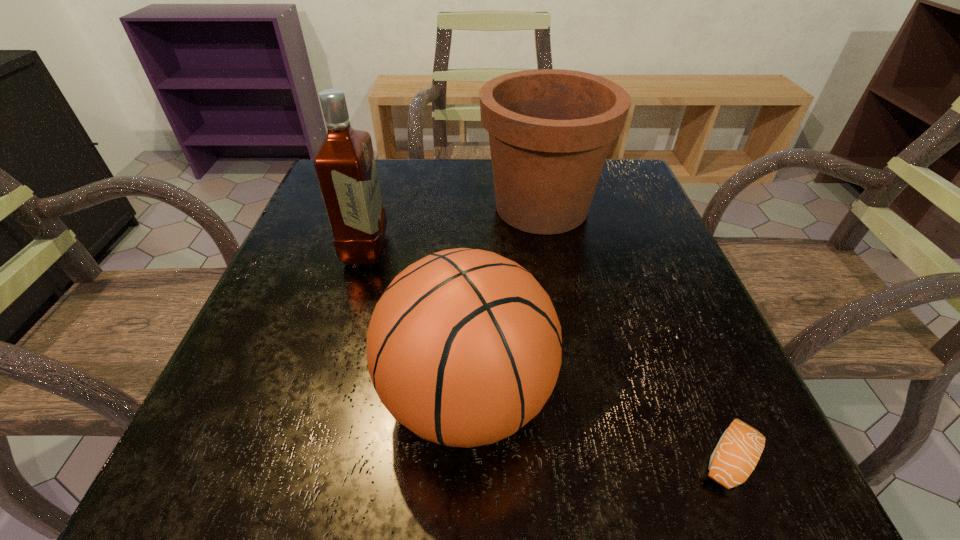
Find the location of a particular element. liquor is located at coordinates (345, 166).

Find the location of `the leftmost object`. the leftmost object is located at coordinates (345, 166).

Locate an element on the screen. This screenshot has height=540, width=960. flowerpot is located at coordinates (550, 130).

Locate an element on the screen. The width and height of the screenshot is (960, 540). basketball is located at coordinates (464, 347).

What are the coordinates of `the rightmost object` in the screenshot? It's located at (738, 451).

Identify the location of sushi. (738, 451).

At what (x,y) coordinates should I click in order to perform the action: click on blank area located on the front label of the liquor. Please return your answer as a coordinate pair (x, y). This screenshot has width=960, height=540. Looking at the image, I should click on (411, 249).

Identify the location of blank space located 0.050m on the back of the flowerpot. This screenshot has width=960, height=540. (534, 166).

Where is `free space located on the back of the basketball`? This screenshot has height=540, width=960. free space located on the back of the basketball is located at coordinates (470, 246).

Find the location of a particular element. free spot located 0.220m on the back of the sushi is located at coordinates (664, 306).